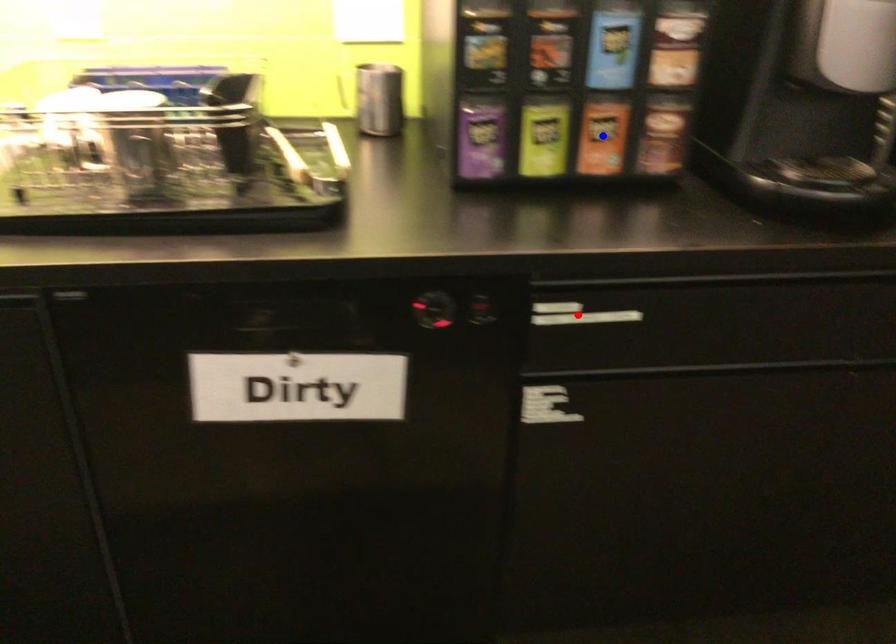
Question: Two points are marked on the image. Which point is closer to the camera?

Choices:
 (A) Blue point is closer.
 (B) Red point is closer.

Answer: (B)